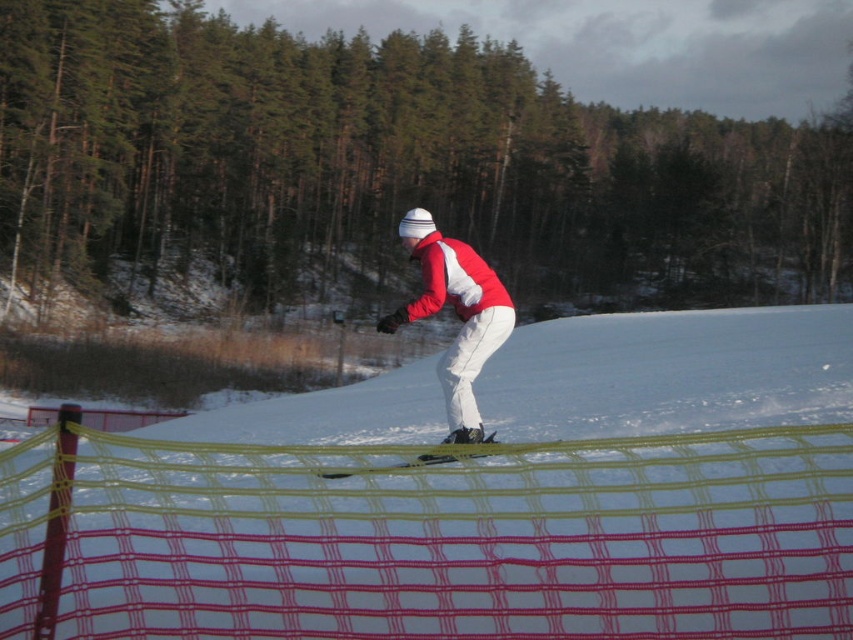
Based on the scene described, which object is taller between the green leafy tree at upper center and the yellow mesh fence at center?

The green leafy tree at upper center is taller than the yellow mesh fence at center.

You are a photographer trying to capture a photo of the green leafy tree at upper center and the matte red snowboarder at center. Which object should you zoom in on to fill the frame more effectively?

The green leafy tree at upper center is bigger than the matte red snowboarder at center, so you should zoom in on the green leafy tree at upper center to fill the frame more effectively.